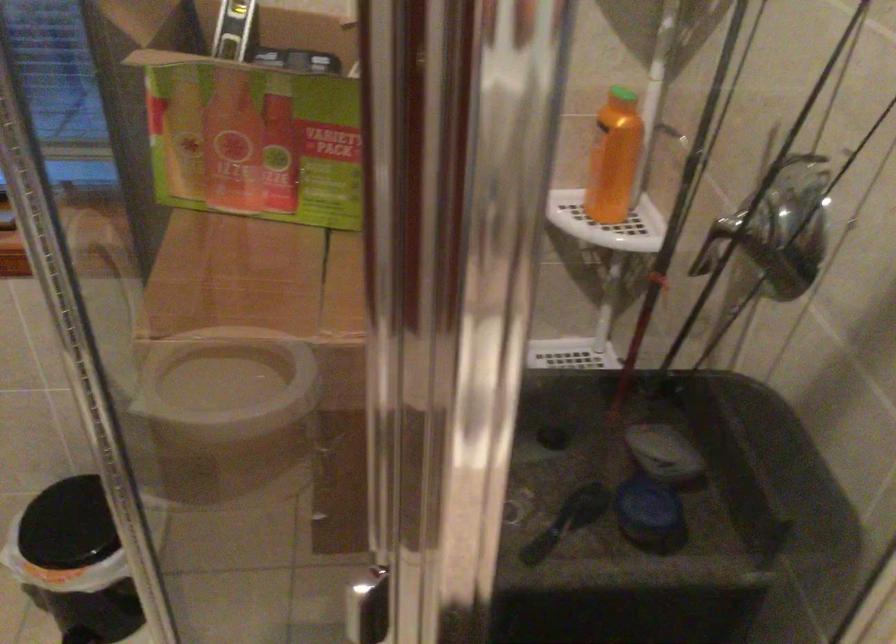
At what (x,y) coordinates should I click in order to perform the action: click on metal shower handle. Please return your answer as a coordinate pair (x, y). The image size is (896, 644). Looking at the image, I should click on (709, 261).